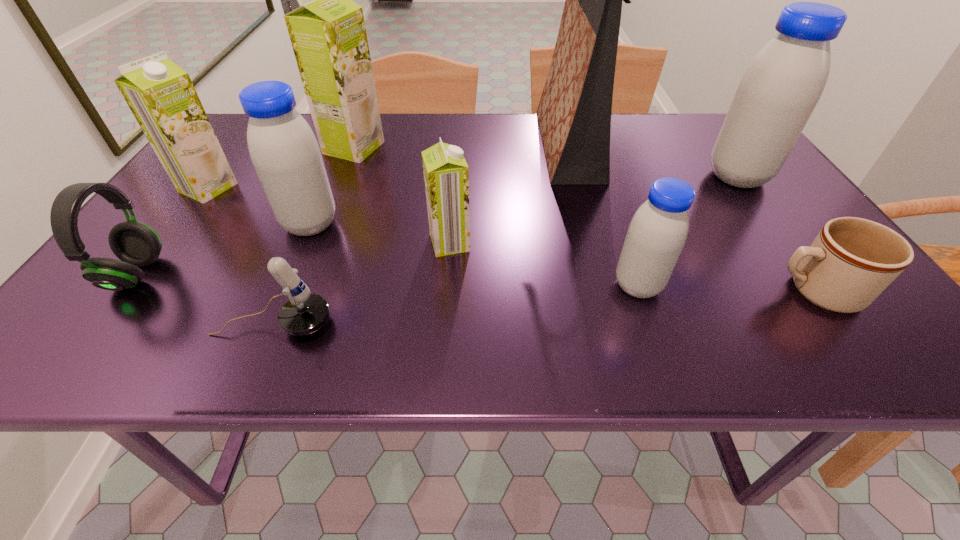
The height and width of the screenshot is (540, 960). Identify the location of free region located 0.120m on the side of the brown mug with the handle. (706, 292).

Identify the location of free spot located on the side of the brown mug with the handle. The height and width of the screenshot is (540, 960). (621, 292).

Find the location of a particular element. This screenshot has height=540, width=960. shopping bag present at the far edge is located at coordinates point(574,113).

In order to click on soya milk at the far edge in this screenshot , I will do `click(328, 35)`.

You are a GUI agent. You are given a task and a screenshot of the screen. Output one action in this format:
    pyautogui.click(x=<x>, y=<y>)
    Task: Click on the object that is at the near edge
    
    Given the screenshot: What is the action you would take?
    pyautogui.click(x=304, y=313)

The image size is (960, 540). Identify the location of soya milk at the left edge. tap(160, 94).

At what (x,y) coordinates should I click in order to perform the action: click on headset that is at the left edge. Please return your answer as a coordinate pair (x, y). The width and height of the screenshot is (960, 540). Looking at the image, I should click on (136, 244).

Find the location of `soya milk that is positioned at the right edge`. soya milk that is positioned at the right edge is located at coordinates (782, 85).

I want to click on mug at the right edge, so click(x=852, y=260).

You are a GUI agent. You are given a task and a screenshot of the screen. Output one action in this format:
    pyautogui.click(x=<x>, y=<y>)
    Task: Click on the blank area at the far edge
    The height and width of the screenshot is (540, 960).
    Given the screenshot: What is the action you would take?
    pyautogui.click(x=685, y=142)